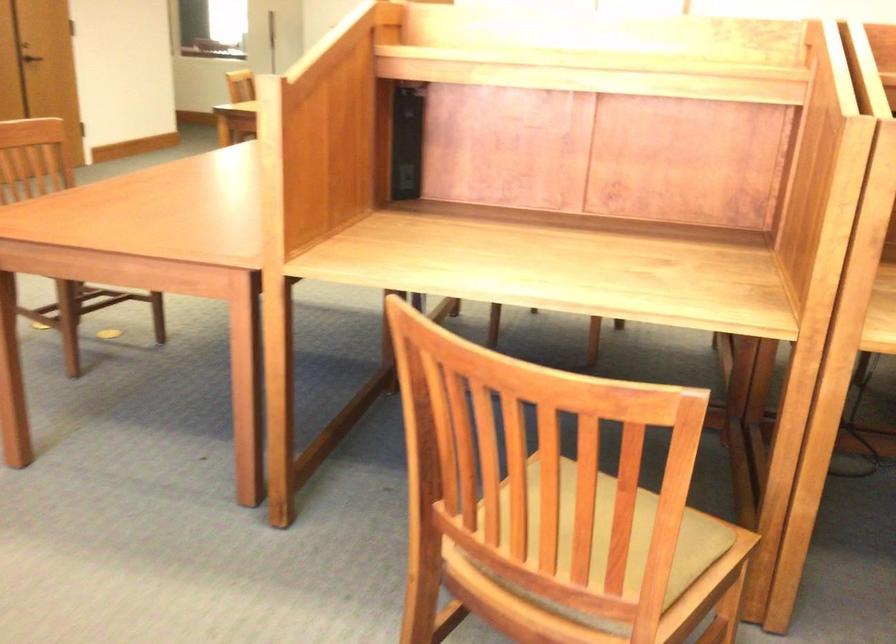
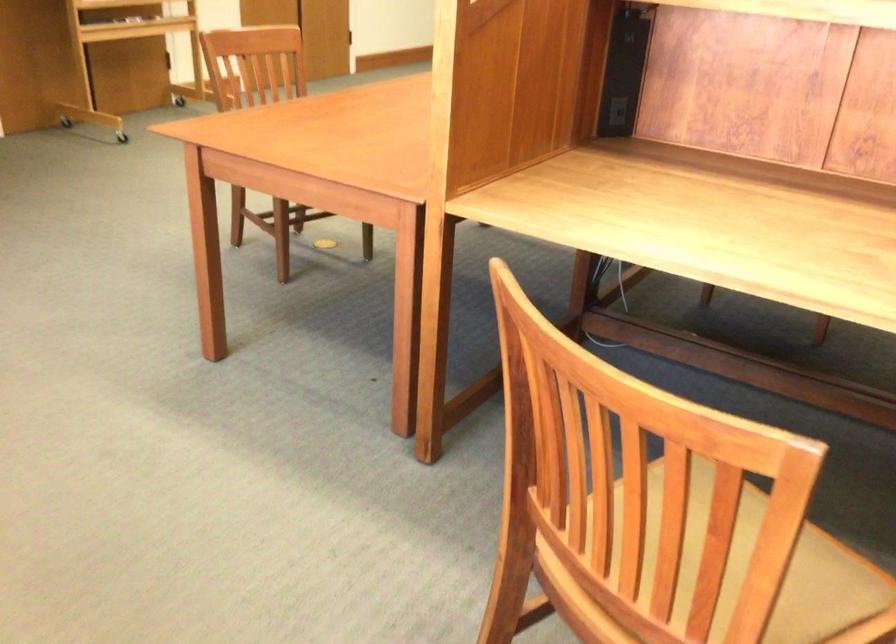
Locate, in the second image, the point that corresponds to point (688, 543) in the first image.

(833, 594)